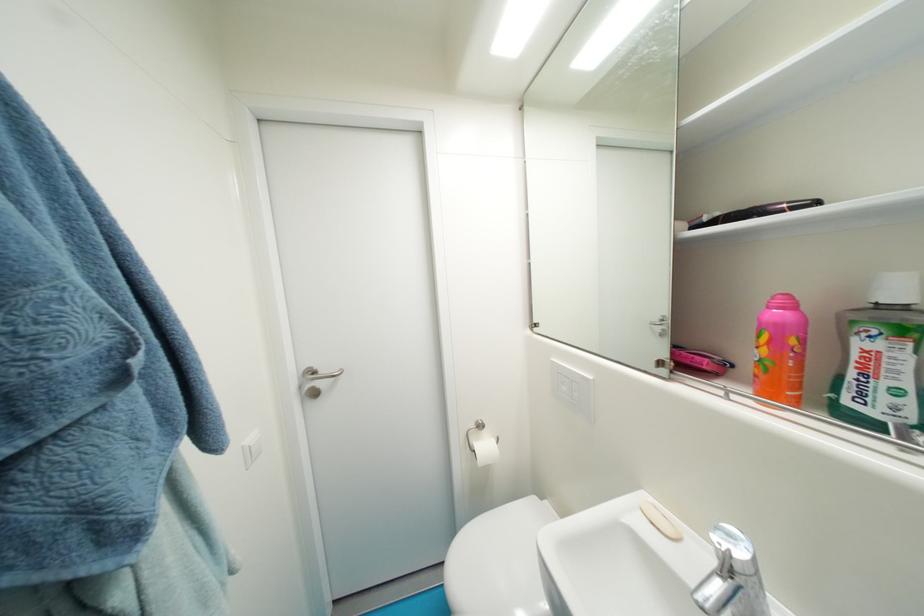
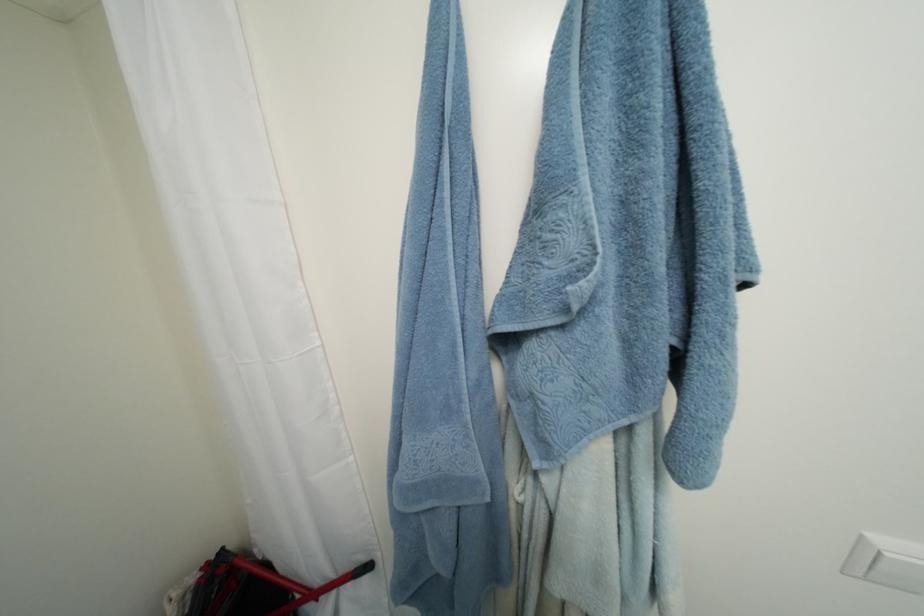
The point at (259,456) is marked in the first image. Where is the corresponding point in the second image?

(880, 570)